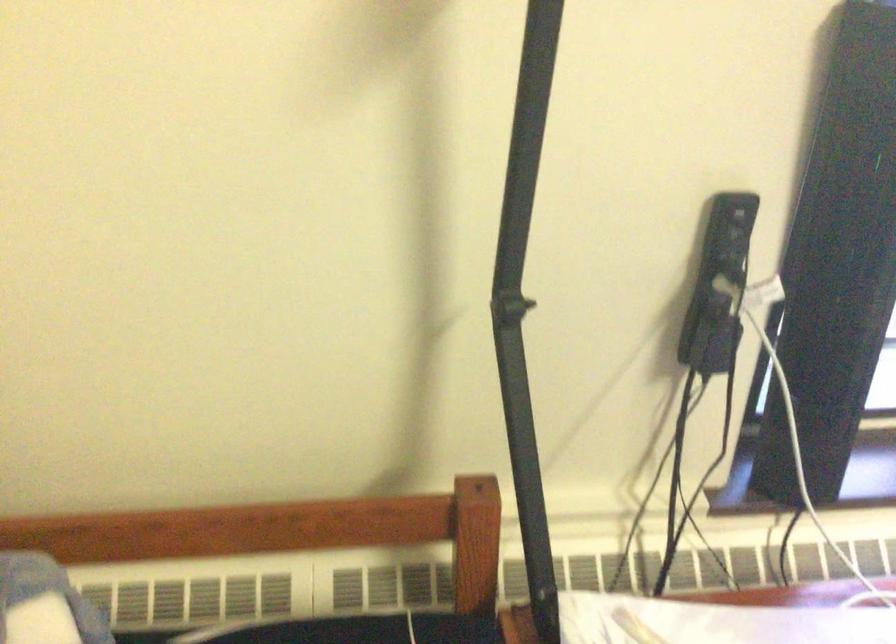
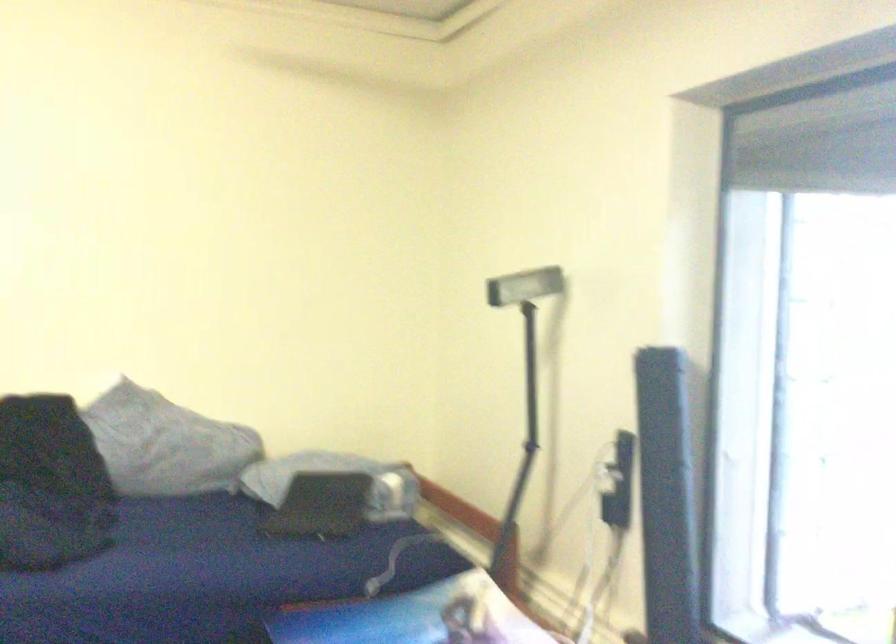
In the second image, find the point that corresponds to [231,131] in the first image.

(522, 377)